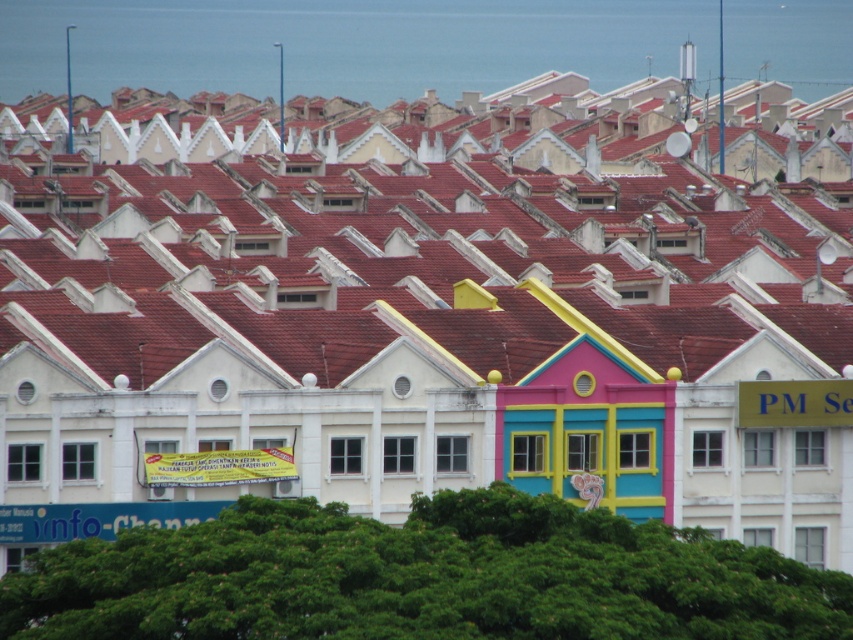
Question: Is red clay tiles at center bigger than multicolored painted house at center?

Choices:
 (A) yes
 (B) no

Answer: (A)

Question: Is red clay tiles at center wider than multicolored painted house at center?

Choices:
 (A) no
 (B) yes

Answer: (B)

Question: Which of the following is the farthest from the observer?

Choices:
 (A) (544, 365)
 (B) (285, 317)

Answer: (B)

Question: Does red clay tiles at center have a larger size compared to multicolored painted house at center?

Choices:
 (A) no
 (B) yes

Answer: (B)